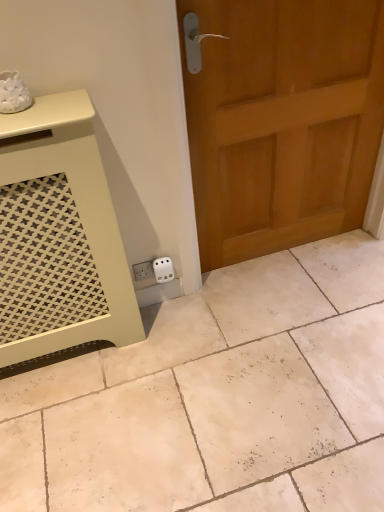
Question: From the image's perspective, is wooden door at right over matte cream vanity at lower left?

Choices:
 (A) no
 (B) yes

Answer: (B)

Question: Can you confirm if wooden door at right is thinner than matte cream vanity at lower left?

Choices:
 (A) yes
 (B) no

Answer: (A)

Question: Can you confirm if wooden door at right is smaller than matte cream vanity at lower left?

Choices:
 (A) yes
 (B) no

Answer: (B)

Question: From a real-world perspective, is wooden door at right over matte cream vanity at lower left?

Choices:
 (A) no
 (B) yes

Answer: (B)

Question: Is wooden door at right outside matte cream vanity at lower left?

Choices:
 (A) yes
 (B) no

Answer: (A)

Question: Relative to white matte tile at lower left, is white plastic electric outlet at lower center in front or behind?

Choices:
 (A) front
 (B) behind

Answer: (B)

Question: Considering the positions of point (160, 266) and point (253, 313), is point (160, 266) closer or farther from the camera than point (253, 313)?

Choices:
 (A) closer
 (B) farther

Answer: (A)

Question: In terms of height, does white plastic electric outlet at lower center look taller or shorter compared to white matte tile at lower left?

Choices:
 (A) short
 (B) tall

Answer: (B)

Question: From the image's perspective, is white plastic electric outlet at lower center positioned above or below white matte tile at lower left?

Choices:
 (A) above
 (B) below

Answer: (A)

Question: Looking at their shapes, would you say white matte tile at lower left is wider or thinner than white plastic electric outlet at lower center?

Choices:
 (A) thin
 (B) wide

Answer: (B)

Question: Choose the correct answer: Is white matte tile at lower left inside white plastic electric outlet at lower center or outside it?

Choices:
 (A) outside
 (B) inside

Answer: (A)

Question: From the image's perspective, is white matte tile at lower left above or below white plastic electric outlet at lower center?

Choices:
 (A) below
 (B) above

Answer: (A)

Question: In terms of size, does white matte tile at lower left appear bigger or smaller than white plastic electric outlet at lower center?

Choices:
 (A) small
 (B) big

Answer: (B)

Question: From the image's perspective, is wooden door at right located above or below matte cream vanity at lower left?

Choices:
 (A) below
 (B) above

Answer: (B)

Question: Is wooden door at right in front of or behind matte cream vanity at lower left in the image?

Choices:
 (A) behind
 (B) front

Answer: (A)